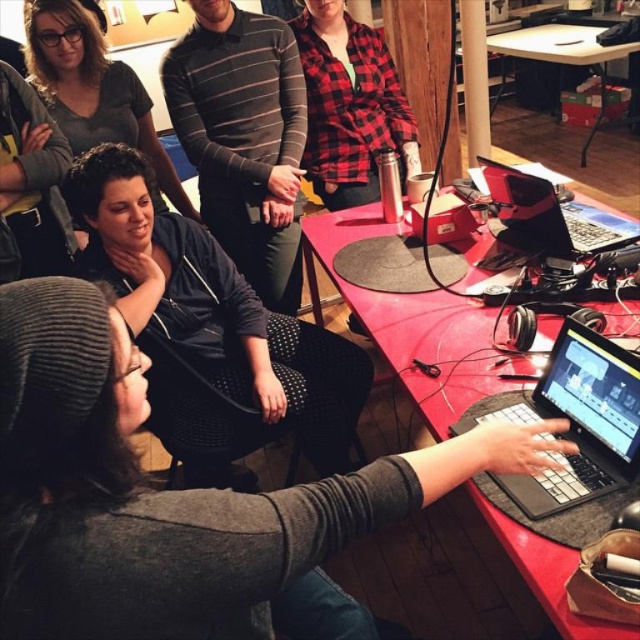
Can you confirm if gray knit beanie at upper left is taller than striped cotton shirt at center?

In fact, gray knit beanie at upper left may be shorter than striped cotton shirt at center.

Between gray knit beanie at upper left and striped cotton shirt at center, which one is positioned higher?

striped cotton shirt at center is higher up.

Is point (225, 630) farther from camera compared to point (221, 234)?

No.

Where is `gray knit beanie at upper left`? gray knit beanie at upper left is located at coordinates (166, 492).

Which is above, black matte jacket at center or striped cotton shirt at center?

striped cotton shirt at center

Does point (208, 253) come behind point (253, 44)?

No, (208, 253) is in front of (253, 44).

Which is in front, point (77, 218) or point (170, 67)?

Point (77, 218)

Where is `black matte jacket at center`? The image size is (640, 640). black matte jacket at center is located at coordinates (212, 323).

Can you confirm if gray knit beanie at upper left is positioned below red plaid shirt at center?

Yes.

The image size is (640, 640). I want to click on gray knit beanie at upper left, so click(166, 492).